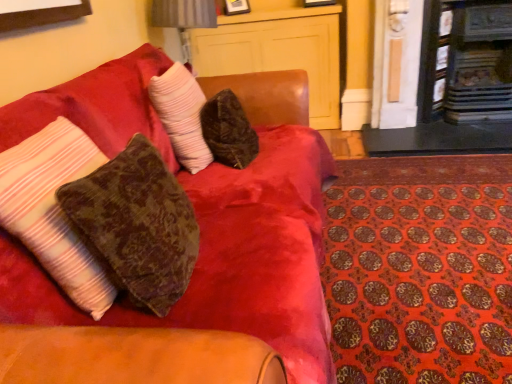
Question: Considering the relative sizes of dark wood fireplace at upper right, the second fireplace from the right, and matte wood dresser at upper center in the image provided, is dark wood fireplace at upper right, the second fireplace from the right, taller than matte wood dresser at upper center?

Choices:
 (A) yes
 (B) no

Answer: (B)

Question: Would you say dark wood fireplace at upper right, arranged as the 1th fireplace when viewed from the left, is outside matte wood dresser at upper center?

Choices:
 (A) yes
 (B) no

Answer: (A)

Question: Is dark wood fireplace at upper right, the second fireplace from the right, bigger than matte wood dresser at upper center?

Choices:
 (A) no
 (B) yes

Answer: (A)

Question: Does dark wood fireplace at upper right, the second fireplace from the right, have a smaller size compared to matte wood dresser at upper center?

Choices:
 (A) no
 (B) yes

Answer: (B)

Question: From the image's perspective, is dark wood fireplace at upper right, arranged as the 1th fireplace when viewed from the left, below matte wood dresser at upper center?

Choices:
 (A) no
 (B) yes

Answer: (B)

Question: Looking at their shapes, would you say dark wood fireplace at upper right, the second fireplace from the right, is wider or thinner than velvet-like brown couch at upper left?

Choices:
 (A) wide
 (B) thin

Answer: (B)

Question: From the image's perspective, is dark wood fireplace at upper right, arranged as the 1th fireplace when viewed from the left, located above or below velvet-like brown couch at upper left?

Choices:
 (A) below
 (B) above

Answer: (B)

Question: Considering their positions, is dark wood fireplace at upper right, arranged as the 1th fireplace when viewed from the left, located in front of or behind velvet-like brown couch at upper left?

Choices:
 (A) front
 (B) behind

Answer: (B)

Question: Is dark wood fireplace at upper right, the second fireplace from the right, to the left or to the right of velvet-like brown couch at upper left in the image?

Choices:
 (A) left
 (B) right

Answer: (B)

Question: Is matte wood dresser at upper center in front of or behind dark wood fireplace at upper right, arranged as the 1th fireplace when viewed from the left, in the image?

Choices:
 (A) front
 (B) behind

Answer: (B)

Question: Considering the positions of matte wood dresser at upper center and dark wood fireplace at upper right, arranged as the 1th fireplace when viewed from the left, in the image, is matte wood dresser at upper center bigger or smaller than dark wood fireplace at upper right, arranged as the 1th fireplace when viewed from the left,?

Choices:
 (A) small
 (B) big

Answer: (B)

Question: Looking at their shapes, would you say matte wood dresser at upper center is wider or thinner than dark wood fireplace at upper right, arranged as the 1th fireplace when viewed from the left?

Choices:
 (A) thin
 (B) wide

Answer: (B)

Question: From a real-world perspective, is matte wood dresser at upper center positioned above or below dark wood fireplace at upper right, arranged as the 1th fireplace when viewed from the left?

Choices:
 (A) below
 (B) above

Answer: (A)

Question: From a real-world perspective, is orange patterned mat at lower right above or below metallic silver table lamp at upper center?

Choices:
 (A) above
 (B) below

Answer: (B)

Question: Choose the correct answer: Is orange patterned mat at lower right inside metallic silver table lamp at upper center or outside it?

Choices:
 (A) inside
 (B) outside

Answer: (B)